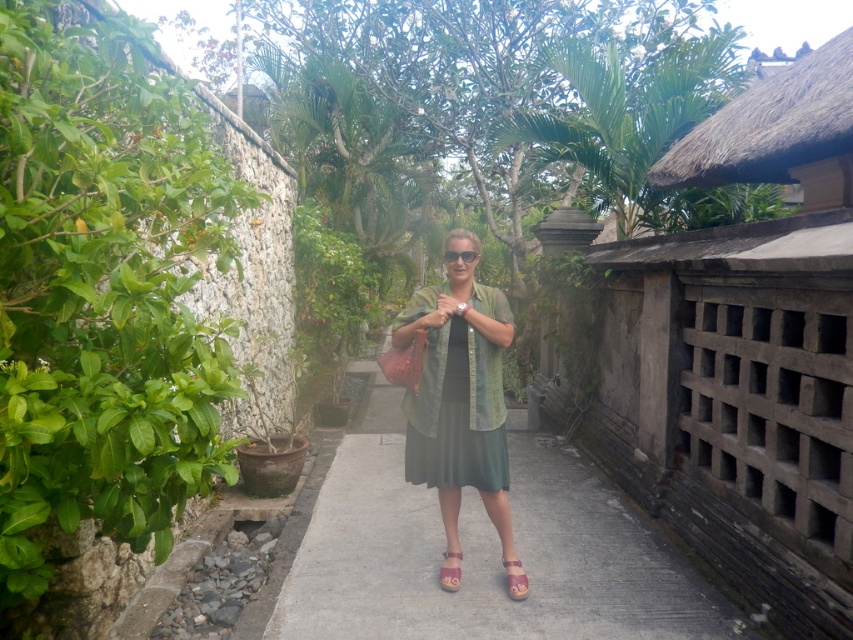
Question: Estimate the real-world distances between objects in this image. Which object is closer to the brown leather sandal at center?

Choices:
 (A) matte black sunglasses at center
 (B) dark green fabric dress at center

Answer: (B)

Question: Among these objects, which one is nearest to the camera?

Choices:
 (A) dark green fabric dress at center
 (B) matte black sunglasses at center
 (C) pink fabric sandal at center

Answer: (A)

Question: Which point appears farthest from the camera in this image?

Choices:
 (A) pos(473,413)
 (B) pos(457,257)
 (C) pos(677,572)
 (D) pos(514,588)

Answer: (C)

Question: Does gray concrete pavement at center have a larger size compared to pink fabric sandal at center?

Choices:
 (A) no
 (B) yes

Answer: (B)

Question: Is gray concrete pavement at center above brown leather sandal at center?

Choices:
 (A) yes
 (B) no

Answer: (B)

Question: Where is pink fabric sandal at center located in relation to matte black sunglasses at center in the image?

Choices:
 (A) left
 (B) right

Answer: (B)